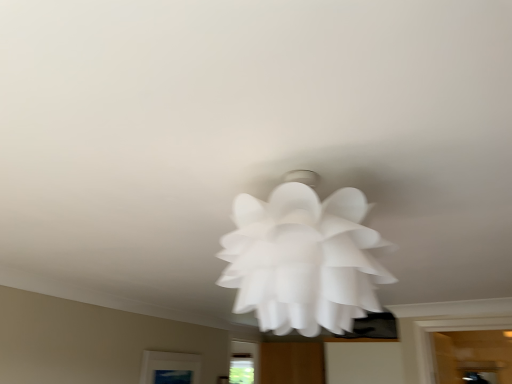
Question: Should I look upward or downward to see white paper flower at center?

Choices:
 (A) up
 (B) down

Answer: (B)

Question: Does white paper flower at center have a smaller size compared to matte glass window at lower center?

Choices:
 (A) no
 (B) yes

Answer: (A)

Question: Is matte glass window at lower center at the back of white paper flower at center?

Choices:
 (A) no
 (B) yes

Answer: (A)

Question: Does white paper flower at center have a greater height compared to matte glass window at lower center?

Choices:
 (A) yes
 (B) no

Answer: (A)

Question: Is white paper flower at center oriented towards matte glass window at lower center?

Choices:
 (A) no
 (B) yes

Answer: (A)

Question: Does white paper flower at center come in front of matte glass window at lower center?

Choices:
 (A) yes
 (B) no

Answer: (A)

Question: Is white paper flower at center to the right of matte glass window at lower center from the viewer's perspective?

Choices:
 (A) no
 (B) yes

Answer: (B)

Question: Is matte glass window at lower center next to white paper flower at center?

Choices:
 (A) yes
 (B) no

Answer: (B)

Question: From a real-world perspective, is matte glass window at lower center physically below white paper flower at center?

Choices:
 (A) no
 (B) yes

Answer: (B)

Question: Is matte glass window at lower center at the right side of white paper flower at center?

Choices:
 (A) no
 (B) yes

Answer: (A)

Question: From a real-world perspective, is matte glass window at lower center on top of white paper flower at center?

Choices:
 (A) yes
 (B) no

Answer: (B)

Question: Considering the relative sizes of matte glass window at lower center and white paper flower at center in the image provided, is matte glass window at lower center shorter than white paper flower at center?

Choices:
 (A) no
 (B) yes

Answer: (B)

Question: From the image's perspective, is matte glass window at lower center under white paper flower at center?

Choices:
 (A) yes
 (B) no

Answer: (A)

Question: Would you say matte glass window at lower center is inside or outside white paper flower at center?

Choices:
 (A) outside
 (B) inside

Answer: (A)